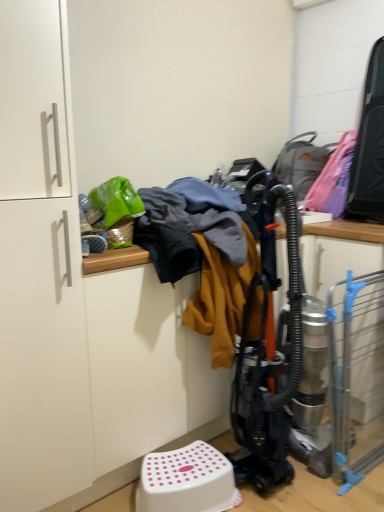
Image resolution: width=384 pixels, height=512 pixels. What do you see at coordinates (117, 233) in the screenshot?
I see `green plastic basket at upper left` at bounding box center [117, 233].

Describe the element at coordinates (116, 200) in the screenshot. Image resolution: width=384 pixels, height=512 pixels. I see `green plastic bag at upper left` at that location.

Measure the distance between point (53, 239) and camera.

Point (53, 239) and camera are 1.21 meters apart.

Identify the location of green plastic basket at upper left. (117, 233).

Does white plastic step stool at lower center have a lesser width compared to green plastic basket at upper left?

No.

Can you confirm if white plastic step stool at lower center is positioned to the right of green plastic basket at upper left?

Indeed, white plastic step stool at lower center is positioned on the right side of green plastic basket at upper left.

Locate an element on the screen. basket that is above the white plastic step stool at lower center (from the image's perspective) is located at coordinates pos(117,233).

Who is smaller, white plastic step stool at lower center or green plastic basket at upper left?

Smaller between the two is green plastic basket at upper left.

Based on the photo, is white matte cabinet at left inside the boundaries of green plastic bag at upper left, or outside?

white matte cabinet at left is spatially situated outside green plastic bag at upper left.

From a real-world perspective, who is located lower, white matte cabinet at left or green plastic bag at upper left?

white matte cabinet at left.

From the picture: From the image's perspective, is white matte cabinet at left located beneath green plastic bag at upper left?

Correct, white matte cabinet at left appears lower than green plastic bag at upper left in the image.

The width and height of the screenshot is (384, 512). What are the coordinates of `basket on the right of green plastic bag at upper left` in the screenshot? It's located at (117, 233).

Is green plastic basket at upper left wider than green plastic bag at upper left?

No.

Which of these two, green plastic basket at upper left or green plastic bag at upper left, is smaller?

Smaller between the two is green plastic basket at upper left.

Is green plastic bag at upper left at the back of green plastic basket at upper left?

No, green plastic basket at upper left is not facing away from green plastic bag at upper left.

Is white plastic step stool at lower center to the right of green plastic bag at upper left from the viewer's perspective?

Indeed, white plastic step stool at lower center is positioned on the right side of green plastic bag at upper left.

Is white plastic step stool at lower center bigger or smaller than green plastic bag at upper left?

Considering their sizes, white plastic step stool at lower center takes up more space than green plastic bag at upper left.

Is the surface of white plastic step stool at lower center in direct contact with green plastic bag at upper left?

They are not placed beside each other.

Is the depth of white plastic step stool at lower center less than that of green plastic bag at upper left?

Yes, it is.

From a real-world perspective, is green plastic bag at upper left on top of white plastic step stool at lower center?

Yes, from a real-world perspective, green plastic bag at upper left is above white plastic step stool at lower center.

Looking at this image, measure the distance from green plastic bag at upper left to white plastic step stool at lower center.

green plastic bag at upper left is 92.97 centimeters away from white plastic step stool at lower center.

Who is more distant, green plastic bag at upper left or white plastic step stool at lower center?

green plastic bag at upper left is further away from the camera.

This screenshot has width=384, height=512. What are the coordinates of `step stool that appears on the right of green plastic bag at upper left` in the screenshot? It's located at click(187, 481).

In the scene shown: Is white plastic step stool at lower center smaller than white matte cabinet at left?

Indeed, white plastic step stool at lower center has a smaller size compared to white matte cabinet at left.

From their relative heights in the image, would you say white plastic step stool at lower center is taller or shorter than white matte cabinet at left?

white plastic step stool at lower center is shorter than white matte cabinet at left.

From the image's perspective, which is above, white plastic step stool at lower center or white matte cabinet at left?

From the image's view, white matte cabinet at left is above.

From the picture: Is white plastic step stool at lower center inside the boundaries of white matte cabinet at left, or outside?

white plastic step stool at lower center is spatially situated outside white matte cabinet at left.

From the image's perspective, is green plastic bag at upper left on white matte cabinet at left?

Correct, green plastic bag at upper left appears higher than white matte cabinet at left in the image.

Locate an element on the screen. This screenshot has height=512, width=384. clothing above the white matte cabinet at left (from a real-world perspective) is located at coordinates (116, 200).

Would you say green plastic bag at upper left is a long distance from white matte cabinet at left?

No, green plastic bag at upper left is not far away from white matte cabinet at left.

Image resolution: width=384 pixels, height=512 pixels. In the image, there is a green plastic basket at upper left. In order to click on step stool below it (from a real-world perspective) in this screenshot , I will do `click(187, 481)`.

The height and width of the screenshot is (512, 384). Find the location of `cabinetry that appears below the green plastic bag at upper left (from the image's perspective)`. cabinetry that appears below the green plastic bag at upper left (from the image's perspective) is located at coordinates (40, 267).

Estimate the real-world distances between objects in this image. Which object is further from white plastic step stool at lower center, green plastic bag at upper left or green plastic basket at upper left?

green plastic bag at upper left.

Considering their positions, is white matte cabinet at left positioned closer to green plastic bag at upper left than white plastic step stool at lower center?

white matte cabinet at left.

Looking at the image, which one is located further to green plastic basket at upper left, white matte cabinet at left or white plastic step stool at lower center?

white plastic step stool at lower center lies further to green plastic basket at upper left than the other object.

Looking at the image, which one is located further to white matte cabinet at left, white plastic step stool at lower center or green plastic bag at upper left?

white plastic step stool at lower center is positioned further to the anchor white matte cabinet at left.

Considering their positions, is white plastic step stool at lower center positioned closer to green plastic bag at upper left than white matte cabinet at left?

Among the two, white matte cabinet at left is located nearer to green plastic bag at upper left.

Estimate the real-world distances between objects in this image. Which object is closer to white matte cabinet at left, green plastic bag at upper left or white plastic step stool at lower center?

green plastic bag at upper left.

From the image, which object appears to be nearer to green plastic basket at upper left, green plastic bag at upper left or white matte cabinet at left?

The object closer to green plastic basket at upper left is green plastic bag at upper left.

From the image, which object appears to be farther from green plastic basket at upper left, white plastic step stool at lower center or green plastic bag at upper left?

white plastic step stool at lower center.

Locate an element on the screen. The height and width of the screenshot is (512, 384). clothing located between white matte cabinet at left and green plastic basket at upper left in the depth direction is located at coordinates (116, 200).

The image size is (384, 512). In order to click on cabinetry between green plastic bag at upper left and white plastic step stool at lower center vertically in this screenshot , I will do `click(40, 267)`.

The height and width of the screenshot is (512, 384). What are the coordinates of `basket between green plastic bag at upper left and white plastic step stool at lower center vertically` in the screenshot? It's located at (117, 233).

Where is `cabinetry between green plastic basket at upper left and white plastic step stool at lower center in the vertical direction`? The width and height of the screenshot is (384, 512). cabinetry between green plastic basket at upper left and white plastic step stool at lower center in the vertical direction is located at coordinates (40, 267).